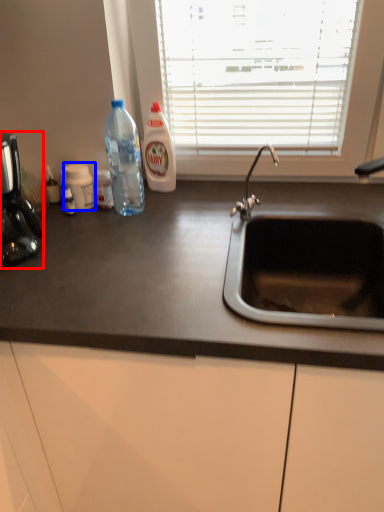
Question: Among these objects, which one is farthest to the camera, coffee machine (highlighted by a red box) or bottle (highlighted by a blue box)?

Choices:
 (A) coffee machine
 (B) bottle

Answer: (B)